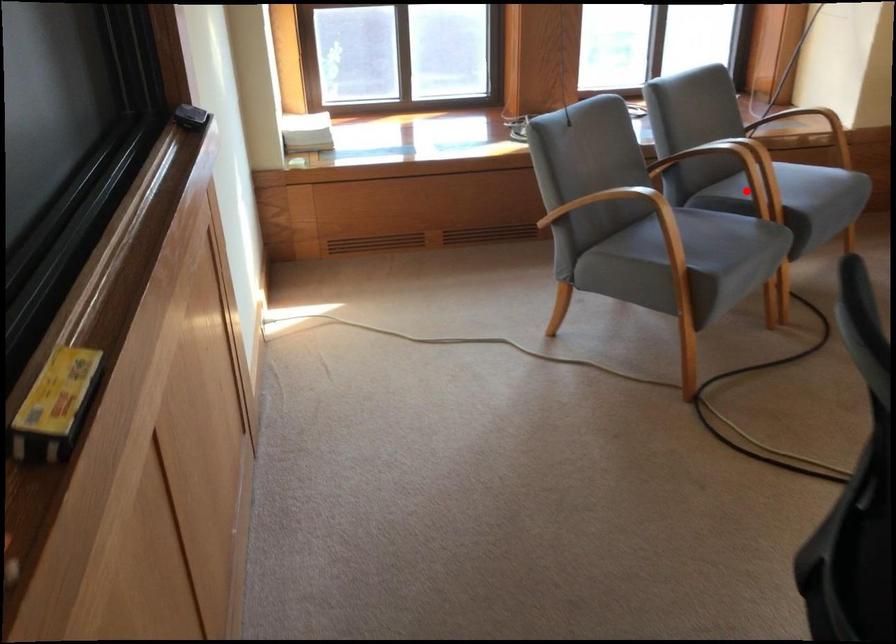
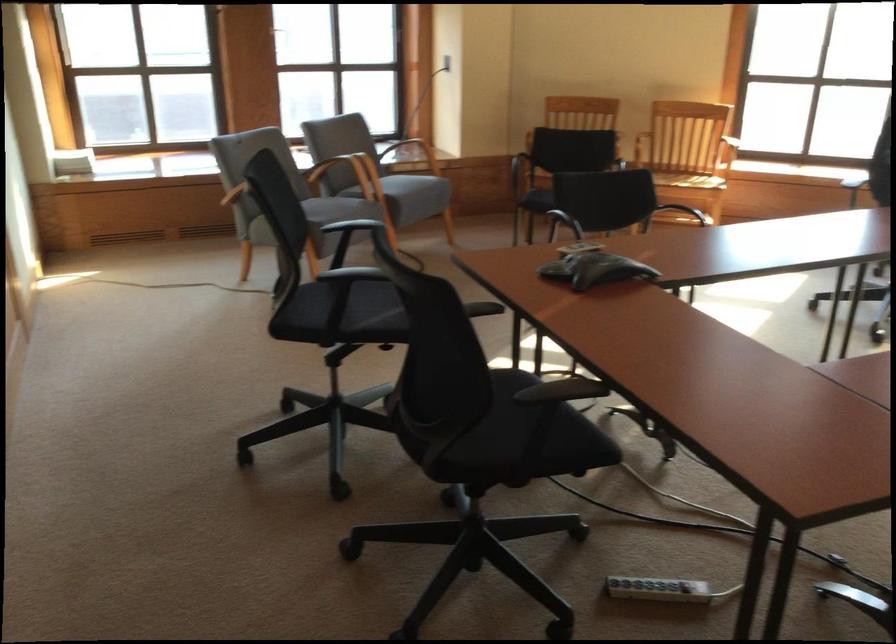
The point at the highlighted location is marked in the first image. Where is the corresponding point in the second image?

(362, 178)